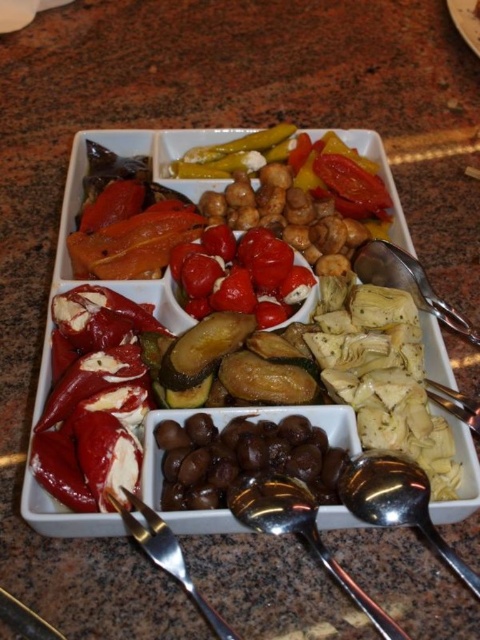
Question: From the image, what is the correct spatial relationship of shiny red peppers at upper left in relation to satin silver spoon at lower center?

Choices:
 (A) right
 (B) left

Answer: (B)

Question: Which of the following is the closest to the observer?

Choices:
 (A) (164, 449)
 (B) (240, 513)

Answer: (B)

Question: Does satin silver spoon at lower center appear under silver metallic fork at lower left?

Choices:
 (A) yes
 (B) no

Answer: (B)

Question: Which of the following is the closest to the observer?

Choices:
 (A) (156, 138)
 (B) (285, 488)
 (C) (184, 566)
 (D) (428, 490)

Answer: (C)

Question: Can you confirm if shiny red peppers at upper left is positioned above shiny dark olives at center?

Choices:
 (A) yes
 (B) no

Answer: (A)

Question: Among these points, which one is farthest from the camera?

Choices:
 (A) (464, 326)
 (B) (256, 492)
 (C) (156, 444)

Answer: (A)